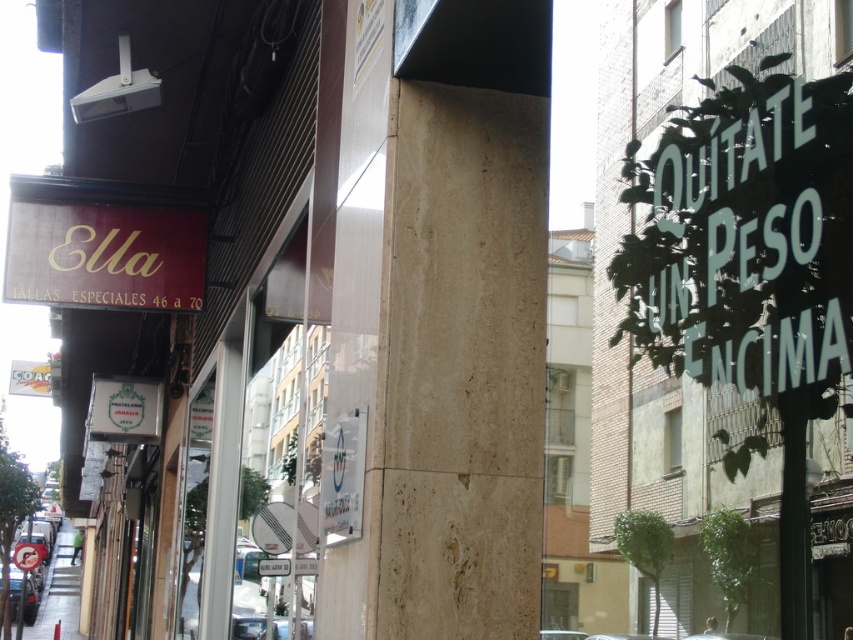
I want to click on beige travertine pillar at center, so click(463, 324).

Who is taller, beige travertine pillar at center or maroon matte signboard at upper left?

With more height is beige travertine pillar at center.

The width and height of the screenshot is (853, 640). I want to click on beige travertine pillar at center, so click(x=463, y=324).